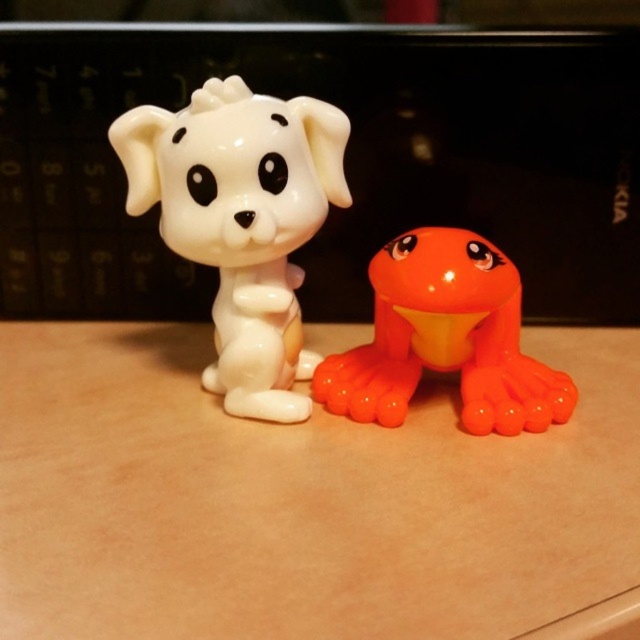
Question: Which object is the farthest from the orange glossy frog at center?

Choices:
 (A) white glossy dog at center
 (B) matte plastic table at center

Answer: (A)

Question: Is matte plastic table at center bigger than white glossy dog at center?

Choices:
 (A) yes
 (B) no

Answer: (A)

Question: Does matte plastic table at center appear on the right side of orange glossy frog at center?

Choices:
 (A) no
 (B) yes

Answer: (A)

Question: Is matte plastic table at center bigger than orange glossy frog at center?

Choices:
 (A) yes
 (B) no

Answer: (A)

Question: Which point appears closest to the camera in this image?

Choices:
 (A) (376, 432)
 (B) (244, 116)
 (C) (368, 376)

Answer: (B)

Question: Based on their relative distances, which object is farther from the matte plastic table at center?

Choices:
 (A) white glossy dog at center
 (B) orange glossy frog at center

Answer: (A)